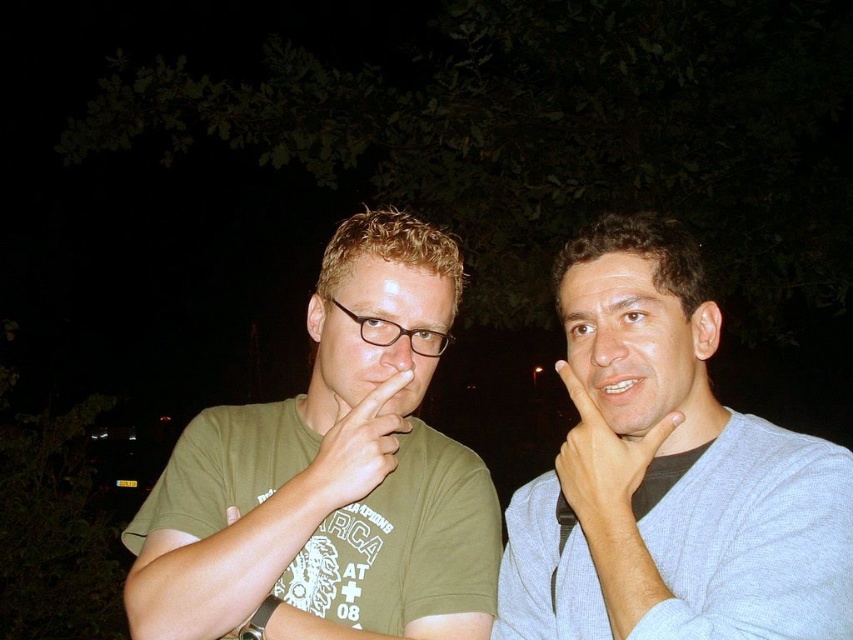
Measure the distance between green matte t-shirt at left and camera.

green matte t-shirt at left is 3.28 feet from camera.

How much distance is there between green matte t-shirt at left and gray sweater at right?

11.58 inches

Is point (345, 227) positioned in front of point (651, 364)?

No.

Identify the location of green matte t-shirt at left. This screenshot has width=853, height=640. (329, 476).

Is point (329, 300) positioned after point (619, 468)?

Yes, it is behind point (619, 468).

Is green matte t-shirt at left positioned in front of skinny white hand at right?

No.

You are a GUI agent. You are given a task and a screenshot of the screen. Output one action in this format:
    pyautogui.click(x=<x>, y=<y>)
    Task: Click on the green matte t-shirt at left
    This screenshot has height=640, width=853.
    Given the screenshot: What is the action you would take?
    pyautogui.click(x=329, y=476)

The height and width of the screenshot is (640, 853). What are the coordinates of `green matte t-shirt at left` in the screenshot? It's located at (329, 476).

In the scene shown: Is gray sweater at right to the left of matte green t-shirt at center from the viewer's perspective?

Incorrect, gray sweater at right is not on the left side of matte green t-shirt at center.

Is point (566, 276) more distant than point (372, 452)?

Yes.

The image size is (853, 640). What are the coordinates of `gray sweater at right` in the screenshot? It's located at (668, 474).